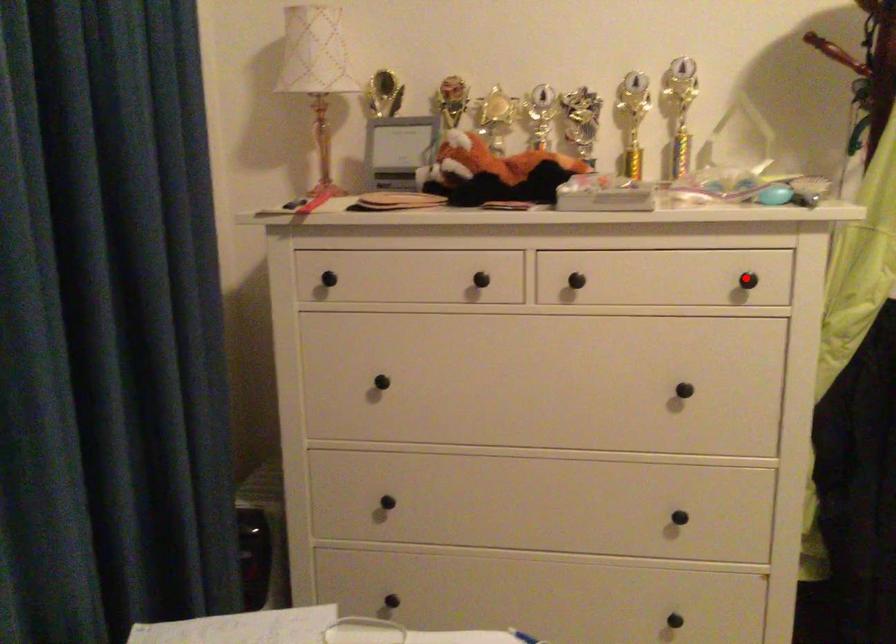
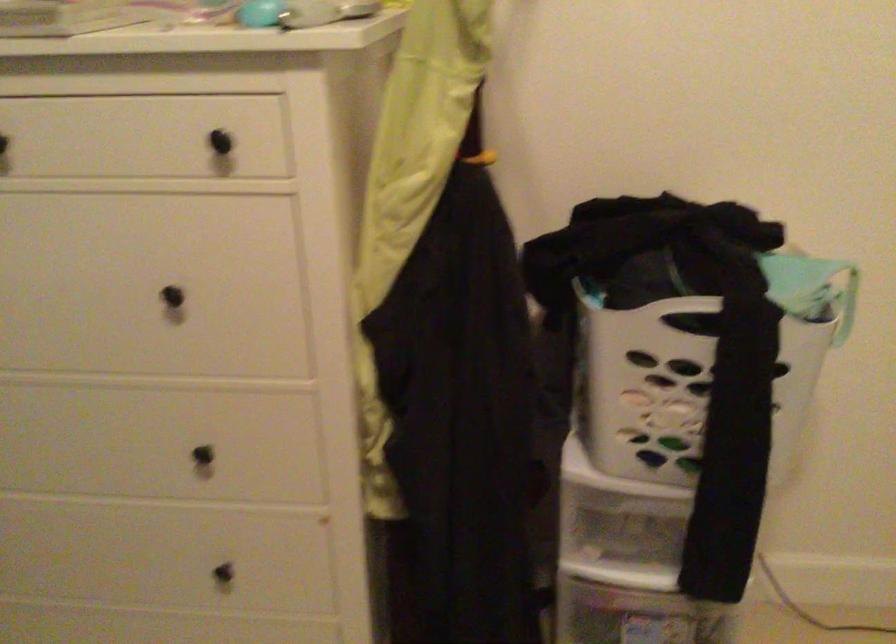
Question: I am providing you with two images of the same scene from different viewpoints. A red point is shown in image1. For the corresponding object point in image2, is it positioned nearer or farther from the camera?

Choices:
 (A) Nearer
 (B) Farther

Answer: (A)